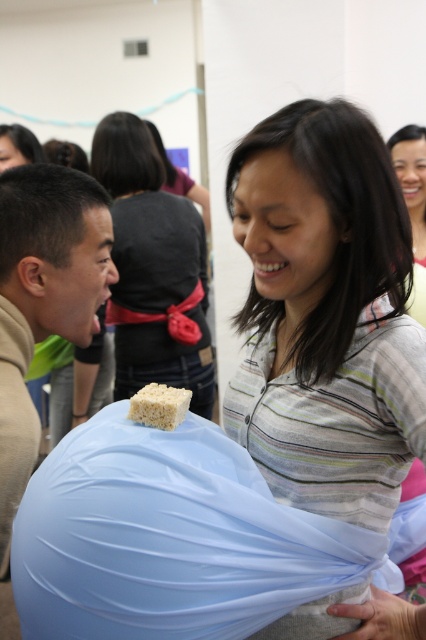
Question: Does striped cotton shirt at center appear on the left side of matte white rice cake at center?

Choices:
 (A) no
 (B) yes

Answer: (A)

Question: Which object is positioned farthest from the striped cotton shirt at center?

Choices:
 (A) matte black hair at upper left
 (B) matte beige shirt at left

Answer: (A)

Question: Which object appears closest to the camera in this image?

Choices:
 (A) matte white rice cake at center
 (B) white rice krispies square at center
 (C) matte beige shirt at left
 (D) striped cotton shirt at center

Answer: (D)

Question: Is matte beige shirt at left behind matte black hair at upper left?

Choices:
 (A) no
 (B) yes

Answer: (A)

Question: Where is matte beige shirt at left located in relation to matte black hair at upper left in the image?

Choices:
 (A) left
 (B) right

Answer: (B)

Question: Which of the following is the farthest from the observer?

Choices:
 (A) (351, 122)
 (B) (0, 125)
 (C) (48, 250)
 (D) (149, 396)

Answer: (B)